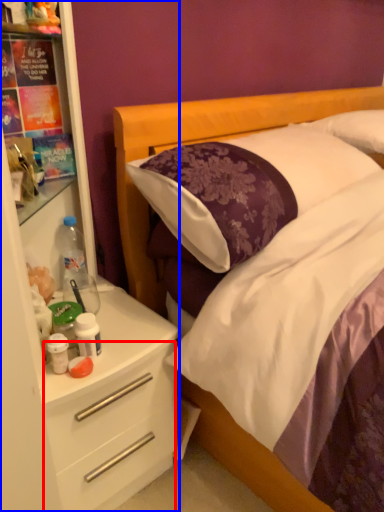
Question: Which of the following is the closest to the observer, drawer (highlighted by a red box) or dresser (highlighted by a blue box)?

Choices:
 (A) drawer
 (B) dresser

Answer: (B)